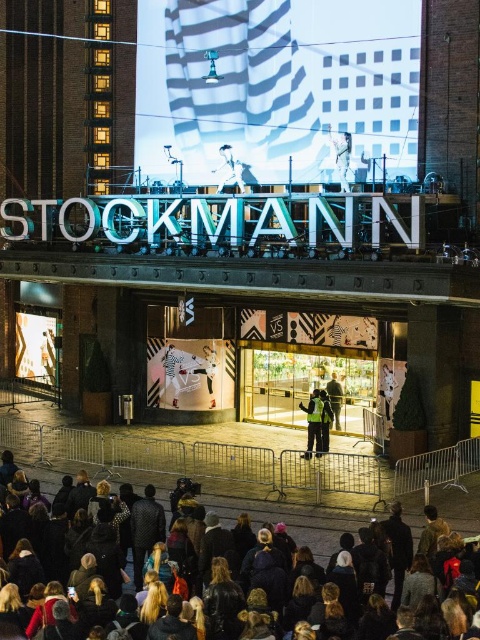
Question: Can you confirm if reflective yellow vest at center is bigger than dark gray jacket at center?

Choices:
 (A) yes
 (B) no

Answer: (B)

Question: Is reflective yellow vest at center behind dark gray jacket at center?

Choices:
 (A) yes
 (B) no

Answer: (A)

Question: Among these objects, which one is farthest from the camera?

Choices:
 (A) black leather jackets at lower center
 (B) dark gray jacket at center
 (C) reflective yellow vest at center
 (D) light brown leather jacket at center

Answer: (D)

Question: Among these points, which one is nearest to the camera?

Choices:
 (A) (311, 422)
 (B) (324, 390)
 (C) (460, 529)

Answer: (C)

Question: Which of the following is the closest to the observer?

Choices:
 (A) (167, 508)
 (B) (323, 406)
 (C) (310, 456)

Answer: (A)

Question: Does black leather jackets at lower center appear under dark gray jacket at center?

Choices:
 (A) yes
 (B) no

Answer: (A)